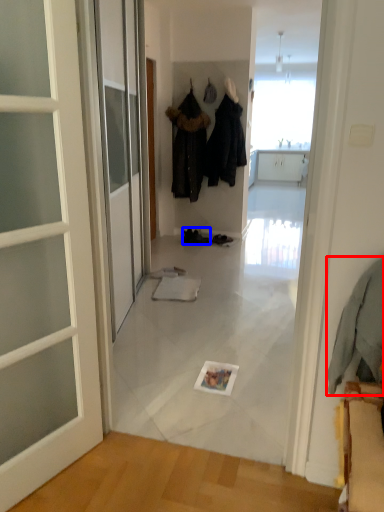
Question: Which point is closer to the camera, clothing (highlighted by a red box) or footwear (highlighted by a blue box)?

Choices:
 (A) clothing
 (B) footwear

Answer: (A)